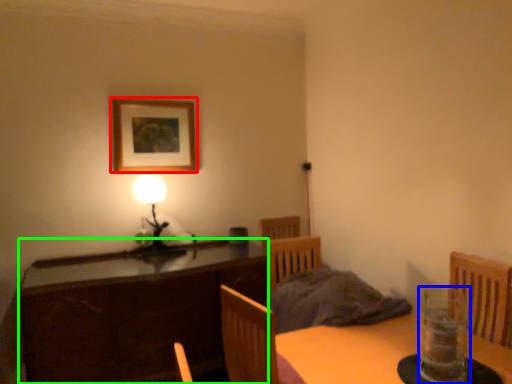
Question: Which object is the closest to the picture frame (highlighted by a red box)? Choose among these: glass vase (highlighted by a blue box) or cabinetry (highlighted by a green box).

Choices:
 (A) glass vase
 (B) cabinetry

Answer: (B)